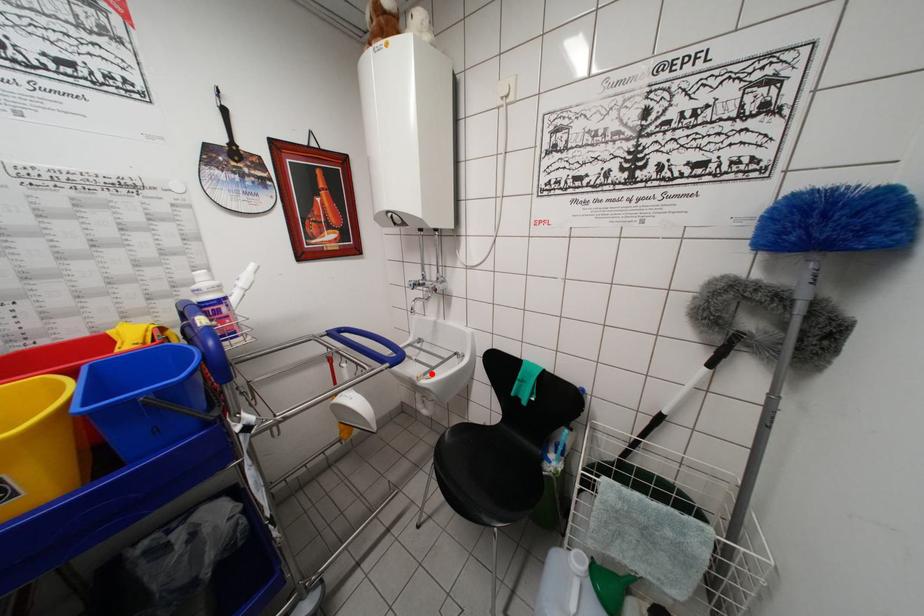
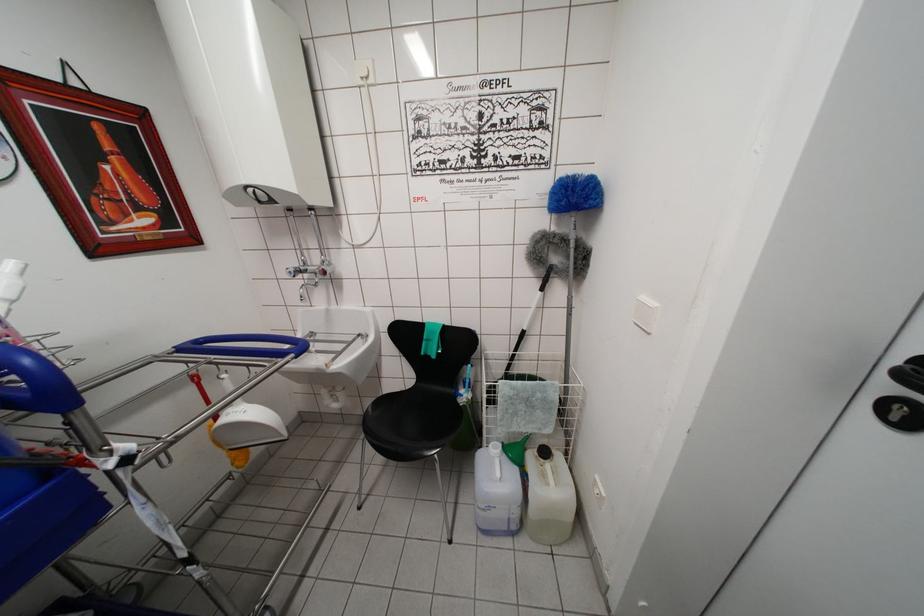
Find the pixel in the second image that matches the highlighted location in the first image.

(338, 360)